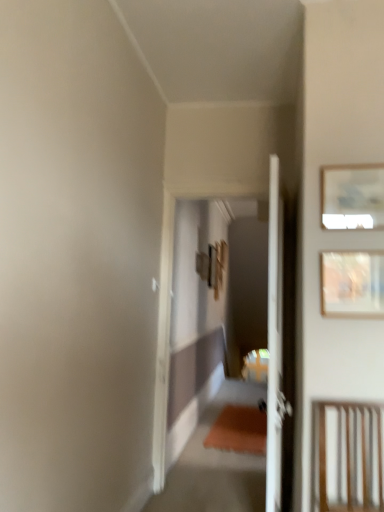
Question: Is wooden slats at lower right at the right side of matte white picture frame at upper right, the second picture frame when ordered from bottom to top?

Choices:
 (A) yes
 (B) no

Answer: (B)

Question: Would you say matte white picture frame at upper right, which is the first picture frame in top-to-bottom order, is part of wooden slats at lower right's contents?

Choices:
 (A) yes
 (B) no

Answer: (B)

Question: Can you confirm if wooden slats at lower right is bigger than matte white picture frame at upper right, the second picture frame when ordered from bottom to top?

Choices:
 (A) yes
 (B) no

Answer: (A)

Question: From the image's perspective, is wooden slats at lower right below matte white picture frame at upper right, which is the first picture frame in top-to-bottom order?

Choices:
 (A) yes
 (B) no

Answer: (A)

Question: Is matte white picture frame at upper right, the second picture frame when ordered from bottom to top, at the back of wooden slats at lower right?

Choices:
 (A) yes
 (B) no

Answer: (B)

Question: Is wooden slats at lower right outside matte white picture frame at upper right, which is the first picture frame in top-to-bottom order?

Choices:
 (A) yes
 (B) no

Answer: (A)

Question: Is wooden framed artwork at upper right, the 1th picture frame positioned from the bottom, surrounded by matte white picture frame at upper right, the second picture frame when ordered from bottom to top?

Choices:
 (A) yes
 (B) no

Answer: (B)

Question: Considering the relative positions of matte white picture frame at upper right, the second picture frame when ordered from bottom to top, and wooden framed artwork at upper right, which ranks as the second picture frame in top-to-bottom order, in the image provided, is matte white picture frame at upper right, the second picture frame when ordered from bottom to top, to the left of wooden framed artwork at upper right, which ranks as the second picture frame in top-to-bottom order, from the viewer's perspective?

Choices:
 (A) no
 (B) yes

Answer: (A)

Question: Is matte white picture frame at upper right, which is the first picture frame in top-to-bottom order, taller than wooden framed artwork at upper right, the 1th picture frame positioned from the bottom?

Choices:
 (A) no
 (B) yes

Answer: (A)

Question: From the image's perspective, is matte white picture frame at upper right, the second picture frame when ordered from bottom to top, below wooden framed artwork at upper right, the 1th picture frame positioned from the bottom?

Choices:
 (A) no
 (B) yes

Answer: (A)

Question: Can we say matte white picture frame at upper right, which is the first picture frame in top-to-bottom order, lies outside wooden framed artwork at upper right, which ranks as the second picture frame in top-to-bottom order?

Choices:
 (A) no
 (B) yes

Answer: (B)

Question: Could you tell me if matte white picture frame at upper right, the second picture frame when ordered from bottom to top, is turned towards wooden framed artwork at upper right, which ranks as the second picture frame in top-to-bottom order?

Choices:
 (A) no
 (B) yes

Answer: (A)

Question: From the image's perspective, is wooden framed artwork at upper right, the 1th picture frame positioned from the bottom, on matte white picture frame at upper right, which is the first picture frame in top-to-bottom order?

Choices:
 (A) no
 (B) yes

Answer: (A)